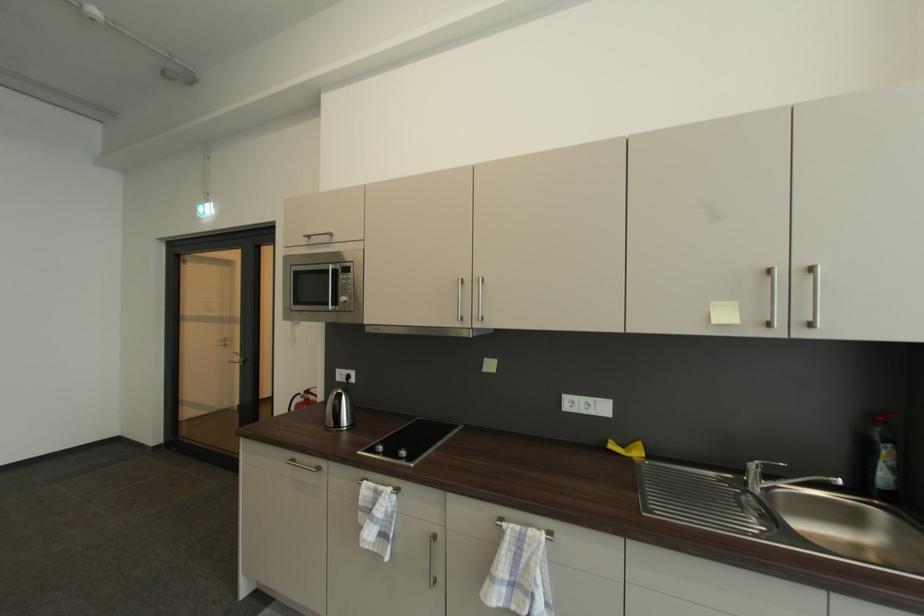
Image resolution: width=924 pixels, height=616 pixels. What do you see at coordinates (758, 469) in the screenshot?
I see `the faucet handle` at bounding box center [758, 469].